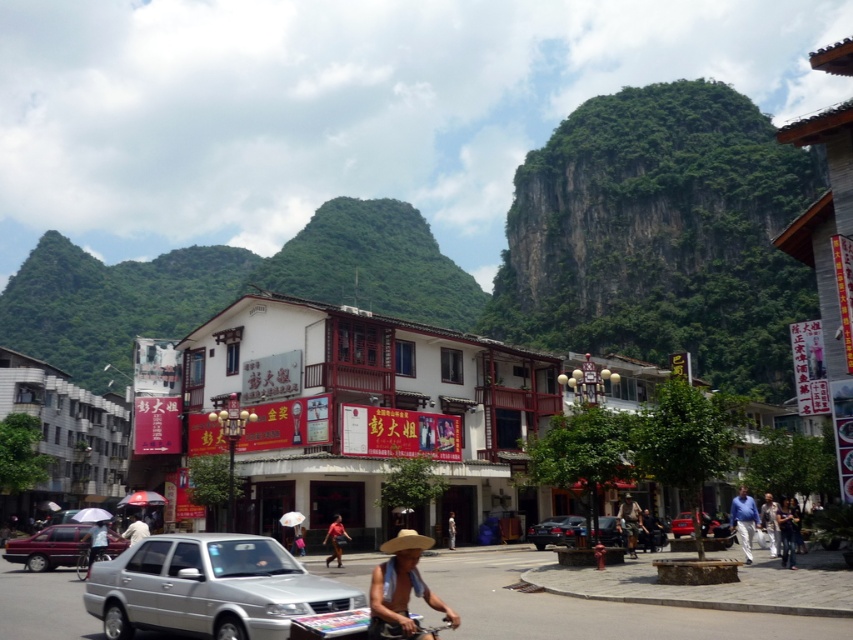
Question: Is metallic silver sedan at center smaller than silver metallic bicycle at lower left?

Choices:
 (A) no
 (B) yes

Answer: (A)

Question: Based on their relative distances, which object is nearer to the metallic silver sedan at center?

Choices:
 (A) light blue fabric umbrella at center
 (B) denim pants at lower right

Answer: (B)

Question: Does metallic red car at center have a greater width compared to red shirt at center?

Choices:
 (A) yes
 (B) no

Answer: (A)

Question: Which object is positioned farthest from the dark gray metallic car at center?

Choices:
 (A) light brown straw hat at center
 (B) green leafy mountain at upper left
 (C) maroon matte car at lower left
 (D) silver metallic bicycle at lower left

Answer: (B)

Question: Can you confirm if maroon matte car at lower left is positioned below light blue fabric umbrella at center?

Choices:
 (A) no
 (B) yes

Answer: (B)

Question: Which of the following is the closest to the observer?

Choices:
 (A) light brown leather jacket at center
 (B) denim pants at lower right

Answer: (B)